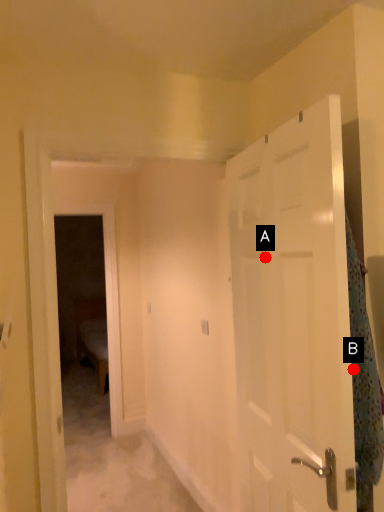
Question: Two points are circled on the image, labeled by A and B beside each circle. Which point appears closest to the camera in this image?

Choices:
 (A) A is closer
 (B) B is closer

Answer: (B)